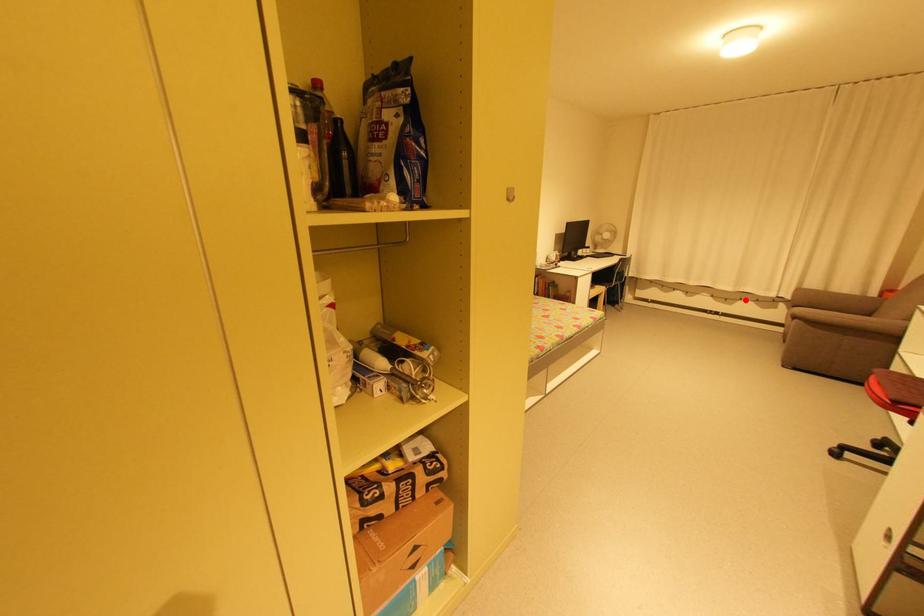
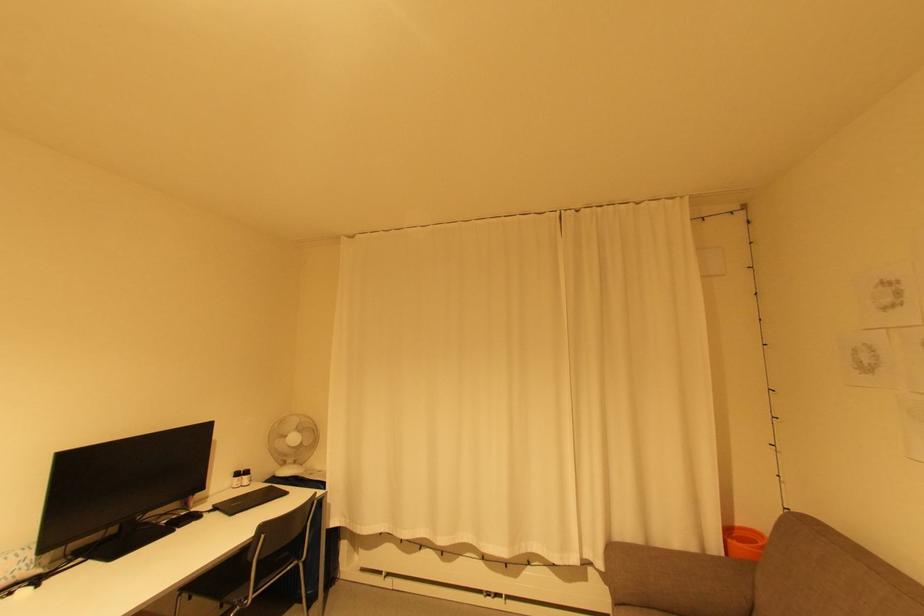
The point at the highlighted location is marked in the first image. Where is the corresponding point in the second image?

(533, 564)